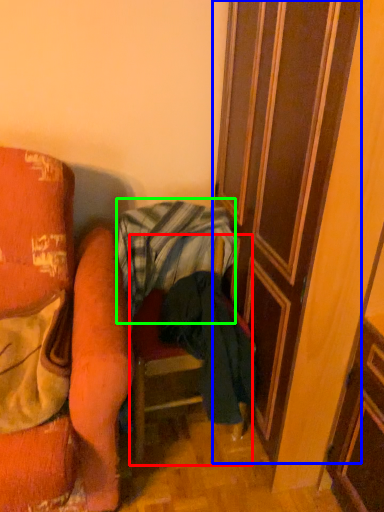
Question: Which is farther away from furniture (highlighted by a red box)? door (highlighted by a blue box) or blanket (highlighted by a green box)?

Choices:
 (A) door
 (B) blanket

Answer: (A)